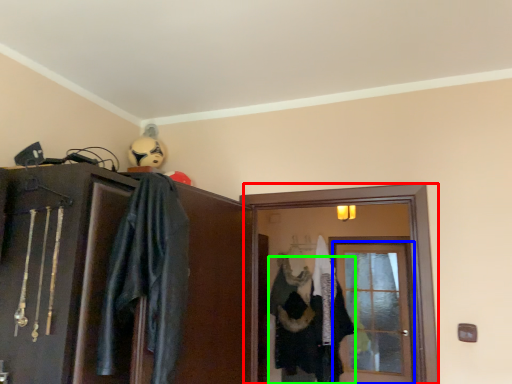
Question: Estimate the real-world distances between objects in this image. Which object is closer to screen door (highlighted by a red box), door (highlighted by a blue box) or clothing (highlighted by a green box)?

Choices:
 (A) door
 (B) clothing

Answer: (A)